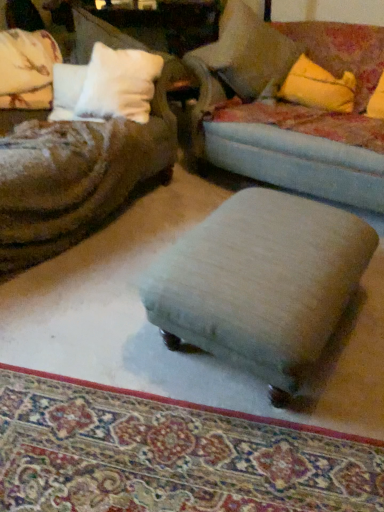
Question: Does light beige fabric stool at center have a larger size compared to velvet blue studio couch at center?

Choices:
 (A) yes
 (B) no

Answer: (B)

Question: From the image's perspective, does light beige fabric stool at center appear higher than velvet blue studio couch at center?

Choices:
 (A) no
 (B) yes

Answer: (A)

Question: Is light beige fabric stool at center facing away from velvet blue studio couch at center?

Choices:
 (A) yes
 (B) no

Answer: (A)

Question: Is light beige fabric stool at center thinner than velvet blue studio couch at center?

Choices:
 (A) no
 (B) yes

Answer: (B)

Question: Is light beige fabric stool at center outside velvet blue studio couch at center?

Choices:
 (A) no
 (B) yes

Answer: (B)

Question: From a real-world perspective, is light beige fabric stool at center over velvet blue studio couch at center?

Choices:
 (A) no
 (B) yes

Answer: (A)

Question: Are soft beige pillow at upper right, the second pillow in the left-to-right sequence, and beige fabric ottoman at center beside each other?

Choices:
 (A) yes
 (B) no

Answer: (B)

Question: Does soft beige pillow at upper right, arranged as the first pillow when viewed from the right, have a lesser width compared to beige fabric ottoman at center?

Choices:
 (A) no
 (B) yes

Answer: (A)

Question: Is soft beige pillow at upper right, arranged as the first pillow when viewed from the right, positioned behind beige fabric ottoman at center?

Choices:
 (A) yes
 (B) no

Answer: (A)

Question: From the image's perspective, is soft beige pillow at upper right, the second pillow in the left-to-right sequence, on beige fabric ottoman at center?

Choices:
 (A) no
 (B) yes

Answer: (B)

Question: From a real-world perspective, is soft beige pillow at upper right, the second pillow in the left-to-right sequence, physically below beige fabric ottoman at center?

Choices:
 (A) yes
 (B) no

Answer: (B)

Question: Does soft beige pillow at upper right, arranged as the first pillow when viewed from the right, appear on the left side of beige fabric ottoman at center?

Choices:
 (A) no
 (B) yes

Answer: (A)

Question: Considering the relative sizes of yellow fabric pillow at upper right and light beige fabric stool at center in the image provided, is yellow fabric pillow at upper right smaller than light beige fabric stool at center?

Choices:
 (A) yes
 (B) no

Answer: (A)